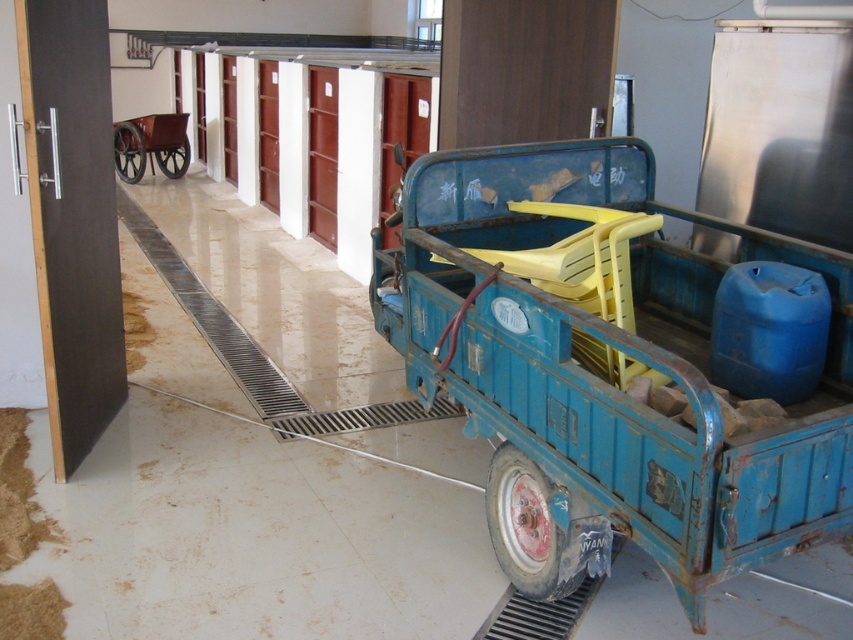
Question: Which object appears farthest from the camera in this image?

Choices:
 (A) rusty blue metal wagon at center
 (B) rubber/smooth tire at center
 (C) rustic metal wheel at center
 (D) wooden wagon at left

Answer: (B)

Question: Is wooden wagon at left wider than rustic metal wheel at center?

Choices:
 (A) yes
 (B) no

Answer: (A)

Question: Which of the following is the farthest from the observer?

Choices:
 (A) (670, 422)
 (B) (181, 161)

Answer: (B)

Question: Is wooden wagon at left further to the viewer compared to rustic metal wheel at center?

Choices:
 (A) yes
 (B) no

Answer: (B)

Question: Can you confirm if wooden wagon at left is wider than rustic metal wheel at center?

Choices:
 (A) yes
 (B) no

Answer: (A)

Question: Which point is farther to the camera?

Choices:
 (A) (141, 156)
 (B) (175, 157)
 (C) (120, 129)

Answer: (B)